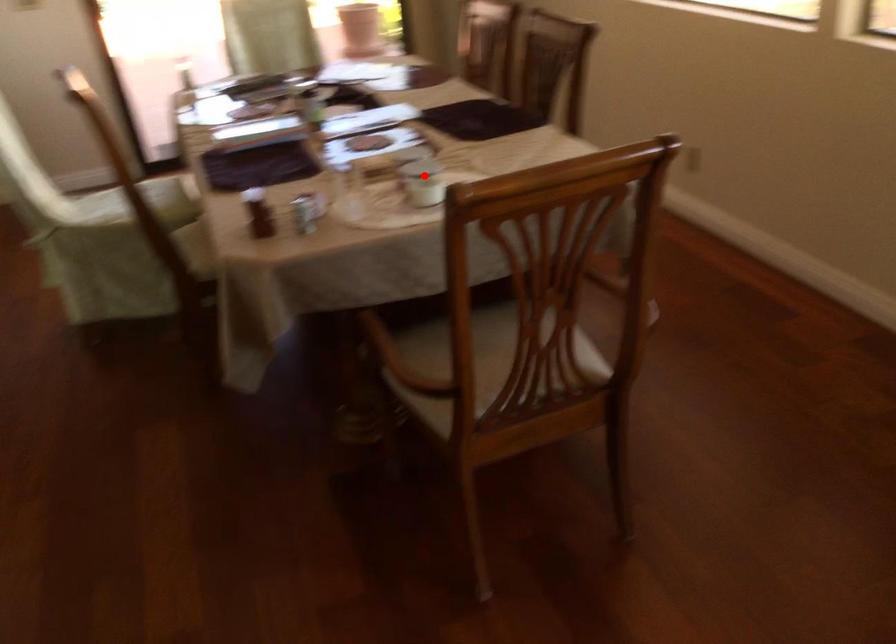
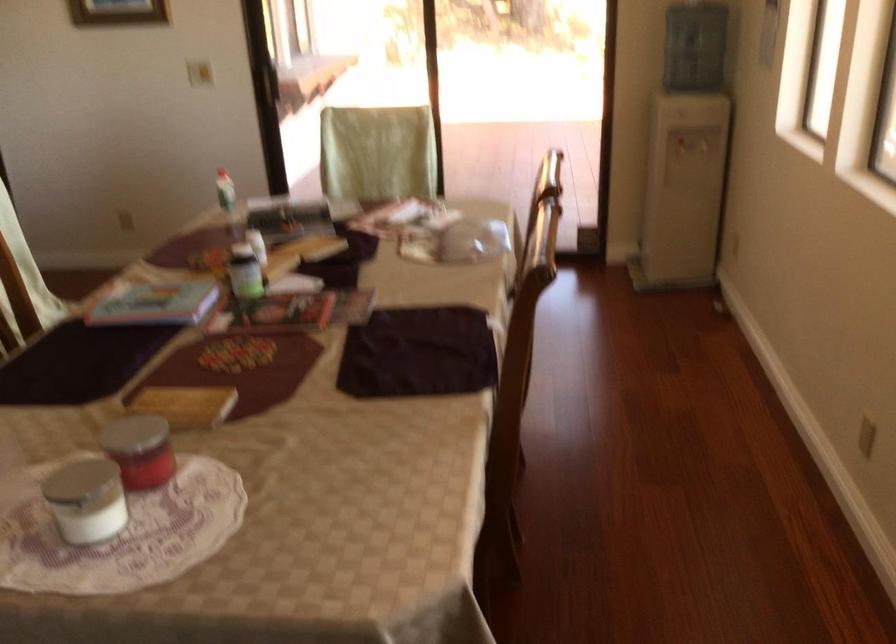
Where in the second image is the point corresponding to the highlighted location from the first image?

(85, 500)